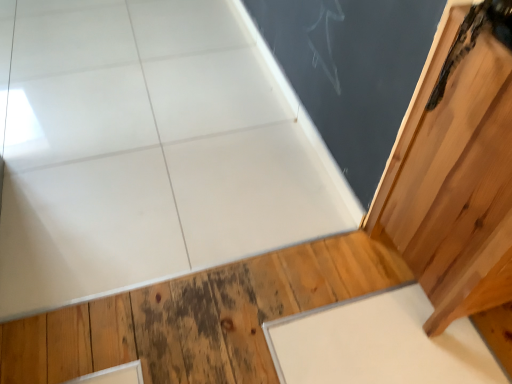
The width and height of the screenshot is (512, 384). I want to click on blank area beneath white matte slate at lower right (from a real-world perspective), so click(x=370, y=345).